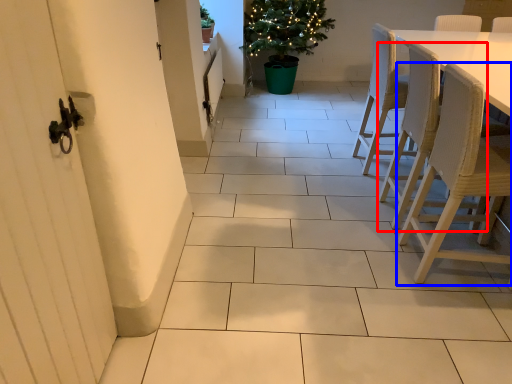
Question: Which of the following is the farthest to the observer, chair (highlighted by a red box) or chair (highlighted by a blue box)?

Choices:
 (A) chair
 (B) chair

Answer: (A)